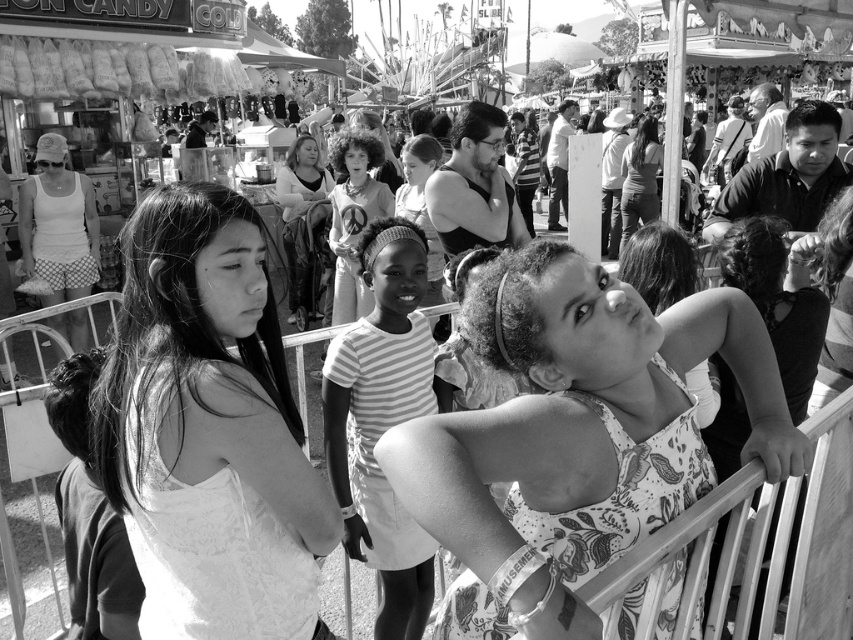
Question: Based on their relative distances, which object is nearer to the white lace dress at center?

Choices:
 (A) striped fabric dress at center
 (B) floral print tank top at center
 (C) matte black dress at center

Answer: (B)

Question: Can you confirm if striped fabric dress at center is positioned to the left of matte black dress at center?

Choices:
 (A) no
 (B) yes

Answer: (A)

Question: Does striped fabric dress at center appear over striped fabric shirt at center?

Choices:
 (A) yes
 (B) no

Answer: (B)

Question: Is white cotton tank top at upper left smaller than striped fabric shirt at center?

Choices:
 (A) yes
 (B) no

Answer: (A)

Question: Among these objects, which one is nearest to the camera?

Choices:
 (A) striped fabric dress at center
 (B) matte black dress at center
 (C) white lace dress at center

Answer: (C)

Question: Which of these objects is positioned farthest from the floral print tank top at center?

Choices:
 (A) matte black dress at center
 (B) white lace dress at center

Answer: (A)